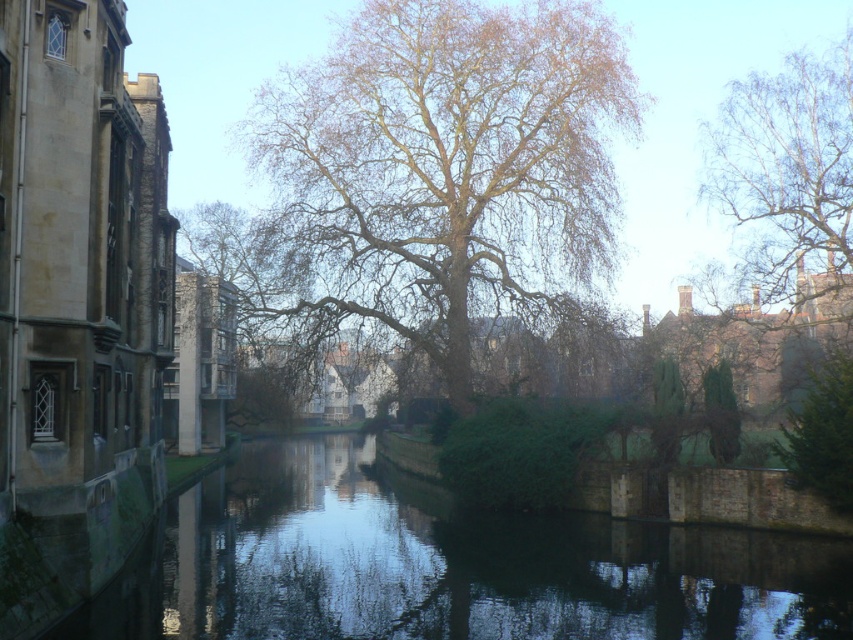
Question: Is dark green water at center below white textured bark at upper right?

Choices:
 (A) no
 (B) yes

Answer: (B)

Question: Which point appears closest to the camera in this image?

Choices:
 (A) (440, 346)
 (B) (714, 150)

Answer: (A)

Question: Which of the following is the farthest from the observer?

Choices:
 (A) dark green water at center
 (B) bare branches tree at center

Answer: (B)

Question: Can you confirm if bare branches tree at center is positioned below white textured bark at upper right?

Choices:
 (A) yes
 (B) no

Answer: (B)

Question: Does bare branches tree at center come in front of white textured bark at upper right?

Choices:
 (A) no
 (B) yes

Answer: (A)

Question: Among these points, which one is nearest to the camera?

Choices:
 (A) (781, 276)
 (B) (532, 154)
 (C) (505, 573)

Answer: (C)